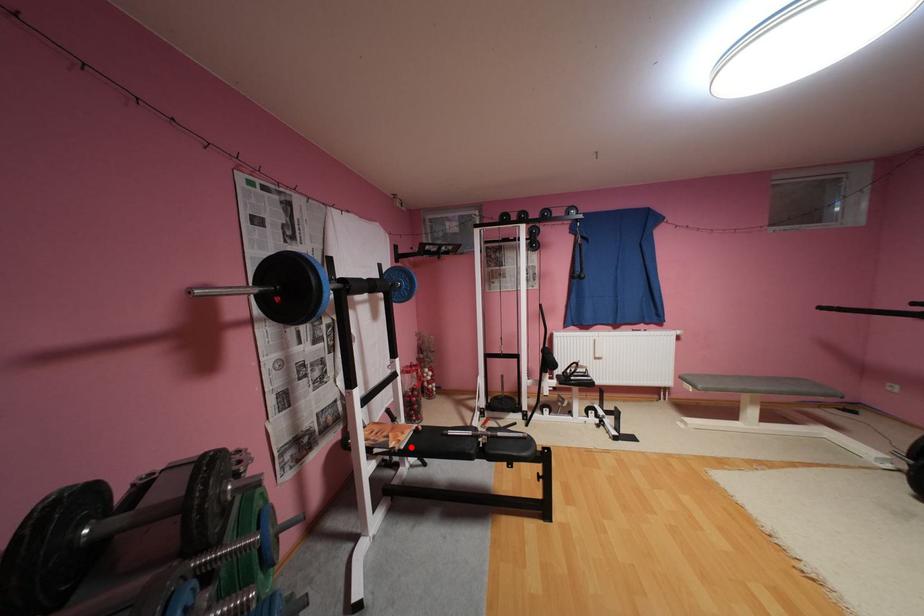
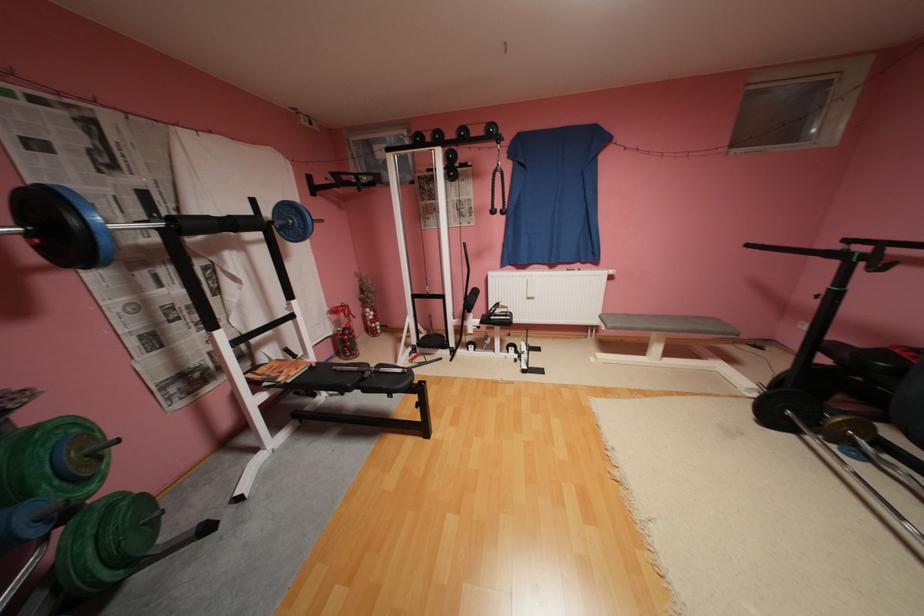
Find the pixel in the second image that matches the highlighted location in the first image.

(298, 381)